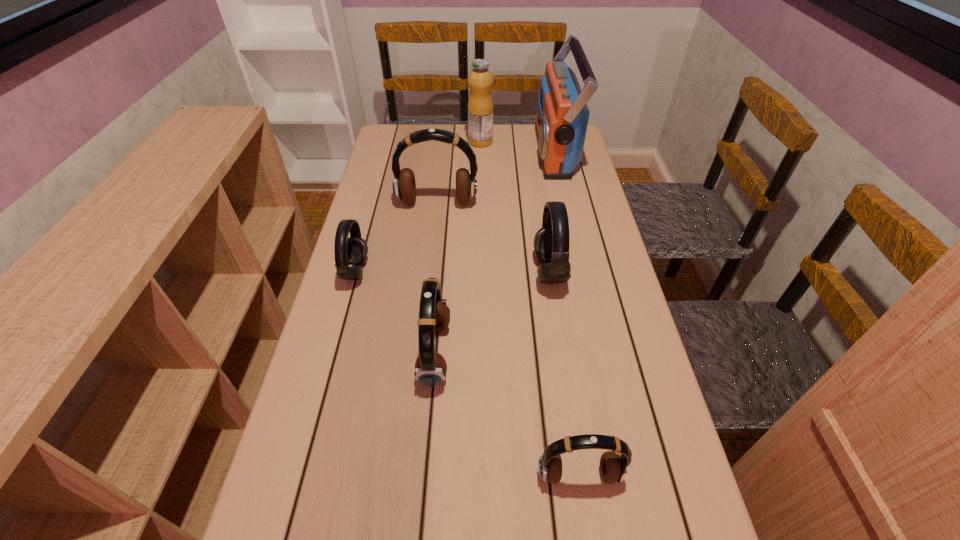
Locate which headset is the second closest to the fruit juice. Please provide its 2D coordinates. Your answer should be formatted as a tuple, i.e. [(x, y)], where the tuple contains the x and y coordinates of a point satisfying the conditions above.

[(551, 242)]

Identify which headset is located as the nearest to the right gray headset. Please provide its 2D coordinates. Your answer should be formatted as a tuple, i.e. [(x, y)], where the tuple contains the x and y coordinates of a point satisfying the conditions above.

[(434, 315)]

The image size is (960, 540). I want to click on brown headset that is the second closest to the fruit juice, so click(x=434, y=315).

The width and height of the screenshot is (960, 540). I want to click on brown headset that is the second closest to the second nearest brown headset, so click(x=404, y=186).

You are a GUI agent. You are given a task and a screenshot of the screen. Output one action in this format:
    pyautogui.click(x=<x>, y=<y>)
    Task: Click on the free location that satisfies the following two spatial constraints: 1. on the front label of the fruit juice; 2. on the ear cup of the farthest headset
    The image size is (960, 540).
    Given the screenshot: What is the action you would take?
    pyautogui.click(x=481, y=203)

Locate an element on the screen. vacant region that satisfies the following two spatial constraints: 1. on the front-facing side of the blue radio receiver; 2. on the ear cup of the nearest object is located at coordinates (627, 475).

Identify the location of free space in the image that satisfies the following two spatial constraints: 1. on the front-facing side of the radio receiver; 2. on the ear cup of the smallest brown headset. (627, 475).

Locate an element on the screen. Image resolution: width=960 pixels, height=540 pixels. vacant space that satisfies the following two spatial constraints: 1. on the front label of the fruit juice; 2. on the ear cup of the farthest brown headset is located at coordinates (481, 203).